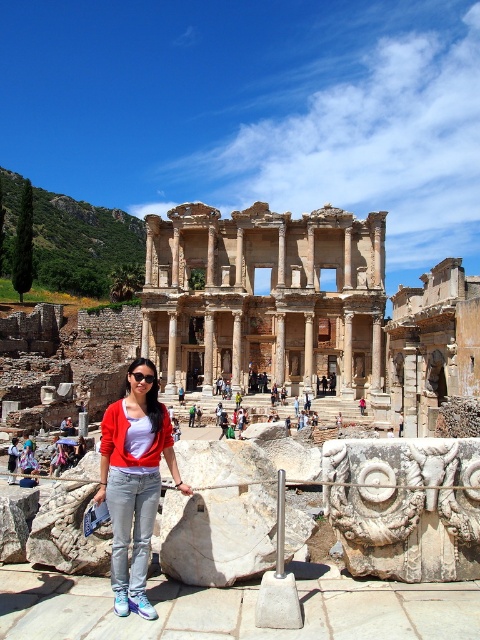
Question: Which point is closer to the camera?

Choices:
 (A) denim jacket at center
 (B) brown stone ruins at center

Answer: (A)

Question: Which point is farther from the camera taking this photo?

Choices:
 (A) (134, 472)
 (B) (313, 381)

Answer: (B)

Question: Can you confirm if brown stone ruins at center is positioned below denim jacket at center?

Choices:
 (A) no
 (B) yes

Answer: (A)

Question: Which point is farther to the camera?

Choices:
 (A) (112, 435)
 (B) (212, 392)

Answer: (B)

Question: Is brown stone ruins at center to the right of denim jacket at center from the viewer's perspective?

Choices:
 (A) no
 (B) yes

Answer: (B)

Question: Can you confirm if brown stone ruins at center is thinner than denim jacket at center?

Choices:
 (A) yes
 (B) no

Answer: (B)